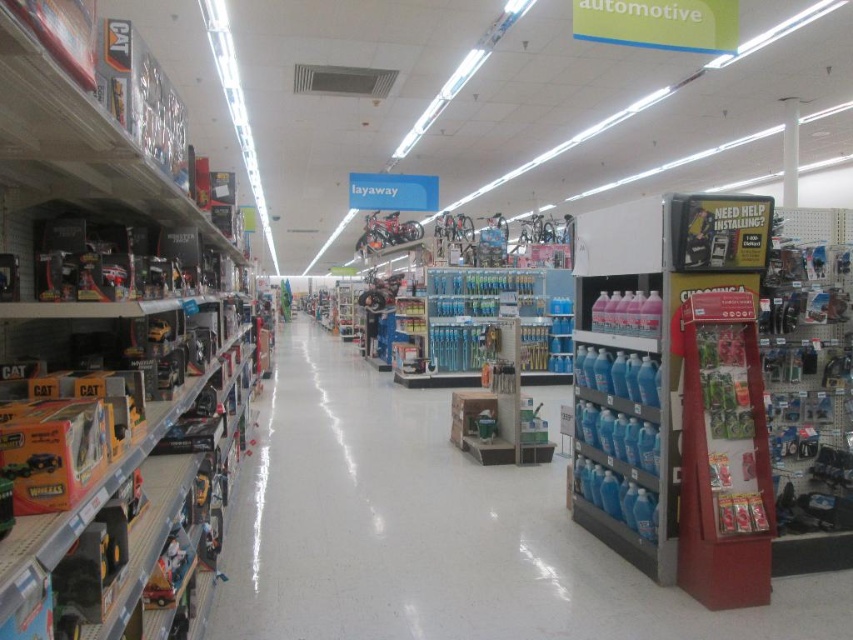
Is clear plastic bottles at center thinner than metallic silver bicycle at center?

Incorrect, clear plastic bottles at center's width is not less than metallic silver bicycle at center's.

Does clear plastic bottles at center have a greater width compared to metallic silver bicycle at center?

Indeed, clear plastic bottles at center has a greater width compared to metallic silver bicycle at center.

The width and height of the screenshot is (853, 640). Describe the element at coordinates (436, 532) in the screenshot. I see `clear plastic bottles at center` at that location.

The image size is (853, 640). What are the coordinates of `clear plastic bottles at center` in the screenshot? It's located at (436, 532).

Which is below, clear plastic bottles at center or metallic silver motorcycle at center?

clear plastic bottles at center

Between clear plastic bottles at center and metallic silver motorcycle at center, which one appears on the left side from the viewer's perspective?

metallic silver motorcycle at center is more to the left.

Is point (514, 602) closer to viewer compared to point (422, 227)?

Yes, it is.

At what (x,y) coordinates should I click in order to perform the action: click on clear plastic bottles at center. Please return your answer as a coordinate pair (x, y). This screenshot has height=640, width=853. Looking at the image, I should click on (436, 532).

Between point (376, 232) and point (439, 218), which one is positioned in front?

Positioned in front is point (439, 218).

What do you see at coordinates (386, 232) in the screenshot? I see `metallic silver motorcycle at center` at bounding box center [386, 232].

The image size is (853, 640). In order to click on metallic silver motorcycle at center in this screenshot , I will do `click(386, 232)`.